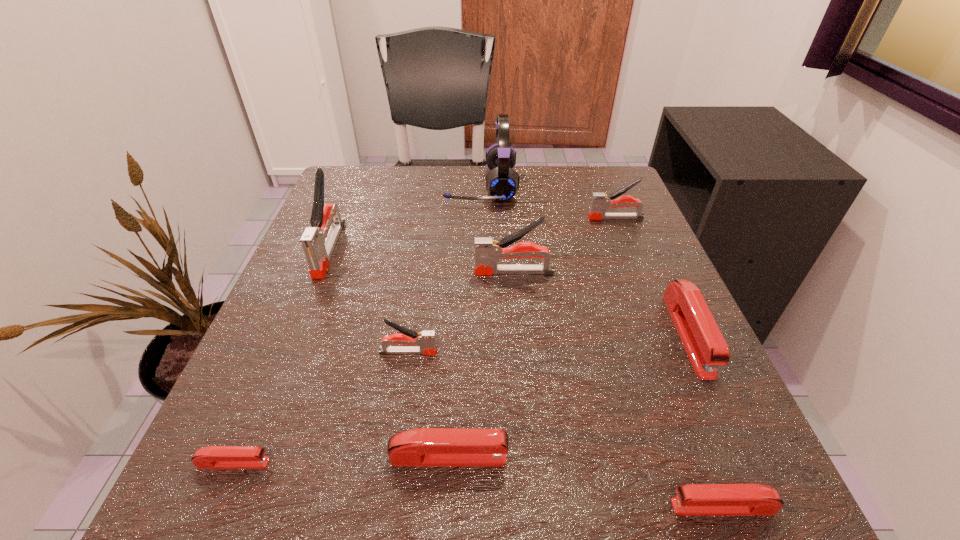
This screenshot has width=960, height=540. Identify the location of the third shortest object. (425, 447).

Identify the location of the third smallest red stapler. The width and height of the screenshot is (960, 540). (425, 447).

I want to click on the nearest stapler, so coord(693,499).

At what (x,y) coordinates should I click in order to perform the action: click on the nearest red stapler. Please return your answer as a coordinate pair (x, y). The image size is (960, 540). Looking at the image, I should click on (693, 499).

Find the location of a particular element. This screenshot has height=540, width=960. the shortest stapler is located at coordinates (211, 457).

Identify the location of the smallest red stapler. (211, 457).

Where is `vacant area situated 0.170m on the ear cushions of the farthest object`? This screenshot has width=960, height=540. vacant area situated 0.170m on the ear cushions of the farthest object is located at coordinates (375, 186).

This screenshot has height=540, width=960. Find the location of `vacant space located on the ear cushions of the farthest object`. vacant space located on the ear cushions of the farthest object is located at coordinates (375, 186).

The width and height of the screenshot is (960, 540). In order to click on vacant space located on the ear cushions of the farthest object in this screenshot , I will do `click(404, 186)`.

Where is `free location located 0.230m on the handle side of the tallest stapler`? free location located 0.230m on the handle side of the tallest stapler is located at coordinates (276, 382).